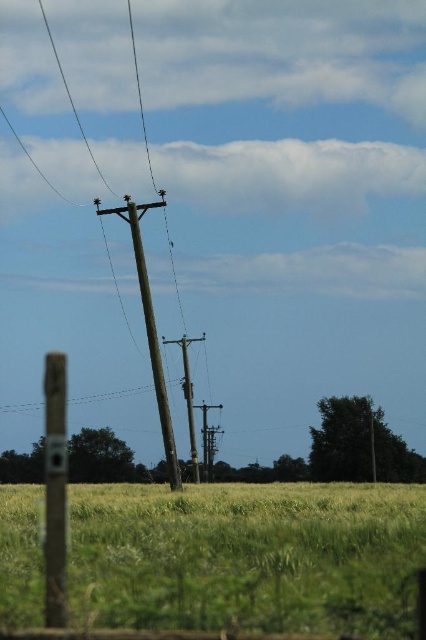
Looking at this image, which is more to the right, brown wooden telegraph pole at center or smooth wood telegraph pole at center?

brown wooden telegraph pole at center

Does point (132, 218) come behind point (193, 472)?

That is False.

Is point (172, 445) farther from viewer compared to point (186, 369)?

No, (172, 445) is in front of (186, 369).

Identify the location of brown wooden telegraph pole at center. (149, 326).

Looking at this image, who is higher up, green grassy field at lower center or brown wooden telegraph pole at center?

brown wooden telegraph pole at center is higher up.

Can you confirm if green grassy field at lower center is positioned above brown wooden telegraph pole at center?

No.

What are the coordinates of `green grassy field at lower center` in the screenshot? It's located at (247, 557).

This screenshot has height=640, width=426. Identify the location of green grassy field at lower center. (247, 557).

Does brown wooden pole at left have a lesser height compared to brown wooden telegraph pole at center?

Yes.

Can you confirm if brown wooden pole at left is positioned to the left of brown wooden telegraph pole at center?

In fact, brown wooden pole at left is to the right of brown wooden telegraph pole at center.

Is point (57, 552) behind point (144, 285)?

No.

Image resolution: width=426 pixels, height=640 pixels. What are the coordinates of `brown wooden pole at left` in the screenshot? It's located at (54, 486).